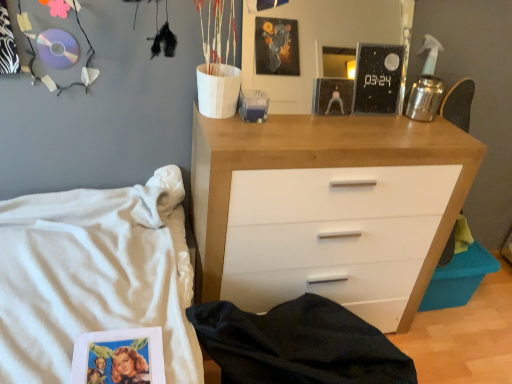
Question: Are white cotton bed at lower left and white wood chest of drawers at center located far from each other?

Choices:
 (A) no
 (B) yes

Answer: (A)

Question: Is white cotton bed at lower left wider than white wood chest of drawers at center?

Choices:
 (A) no
 (B) yes

Answer: (B)

Question: Are white cotton bed at lower left and white wood chest of drawers at center beside each other?

Choices:
 (A) no
 (B) yes

Answer: (A)

Question: From a real-world perspective, is white cotton bed at lower left on top of white wood chest of drawers at center?

Choices:
 (A) no
 (B) yes

Answer: (A)

Question: Is the position of white cotton bed at lower left less distant than that of white wood chest of drawers at center?

Choices:
 (A) no
 (B) yes

Answer: (B)

Question: Is white cotton bed at lower left positioned behind white wood chest of drawers at center?

Choices:
 (A) yes
 (B) no

Answer: (B)

Question: Can you confirm if white wood chest of drawers at center is bigger than white cotton bed at lower left?

Choices:
 (A) no
 (B) yes

Answer: (A)

Question: Is white wood chest of drawers at center positioned beyond the bounds of white cotton bed at lower left?

Choices:
 (A) yes
 (B) no

Answer: (A)

Question: Is white wood chest of drawers at center taller than white cotton bed at lower left?

Choices:
 (A) no
 (B) yes

Answer: (B)

Question: From a real-world perspective, is white wood chest of drawers at center on top of white cotton bed at lower left?

Choices:
 (A) no
 (B) yes

Answer: (B)

Question: Is white wood chest of drawers at center behind white cotton bed at lower left?

Choices:
 (A) yes
 (B) no

Answer: (A)

Question: Is white wood chest of drawers at center shorter than white cotton bed at lower left?

Choices:
 (A) yes
 (B) no

Answer: (B)

Question: Could you tell me if white cotton bed at lower left is facing black glossy clock at upper center?

Choices:
 (A) yes
 (B) no

Answer: (A)